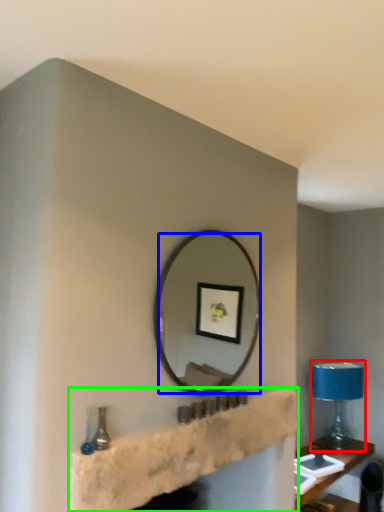
Question: Considering the real-world distances, which object is closest to table lamp (highlighted by a red box)? mirror (highlighted by a blue box) or shelf (highlighted by a green box).

Choices:
 (A) mirror
 (B) shelf

Answer: (A)